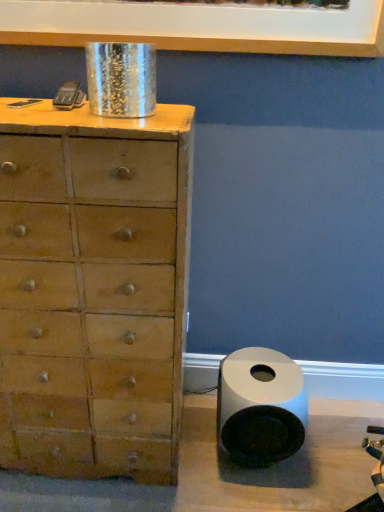
Question: Is wooden chest of drawers at left positioned with its back to white glossy speaker at lower right?

Choices:
 (A) yes
 (B) no

Answer: (B)

Question: Can you confirm if wooden chest of drawers at left is smaller than white glossy speaker at lower right?

Choices:
 (A) no
 (B) yes

Answer: (A)

Question: Is wooden chest of drawers at left outside of white glossy speaker at lower right?

Choices:
 (A) no
 (B) yes

Answer: (B)

Question: From a real-world perspective, is wooden chest of drawers at left located beneath white glossy speaker at lower right?

Choices:
 (A) no
 (B) yes

Answer: (A)

Question: From the image's perspective, is wooden chest of drawers at left under white glossy speaker at lower right?

Choices:
 (A) yes
 (B) no

Answer: (B)

Question: From the image's perspective, relative to white glossy picture frame at upper center, is wooden chest of drawers at left above or below?

Choices:
 (A) above
 (B) below

Answer: (B)

Question: From a real-world perspective, relative to white glossy picture frame at upper center, is wooden chest of drawers at left vertically above or below?

Choices:
 (A) above
 (B) below

Answer: (B)

Question: From their relative heights in the image, would you say wooden chest of drawers at left is taller or shorter than white glossy picture frame at upper center?

Choices:
 (A) tall
 (B) short

Answer: (A)

Question: Is wooden chest of drawers at left wider or thinner than white glossy picture frame at upper center?

Choices:
 (A) thin
 (B) wide

Answer: (B)

Question: Considering the positions of point (251, 454) and point (61, 130), is point (251, 454) closer or farther from the camera than point (61, 130)?

Choices:
 (A) closer
 (B) farther

Answer: (B)

Question: Considering the positions of white glossy speaker at lower right and wooden chest of drawers at left in the image, is white glossy speaker at lower right wider or thinner than wooden chest of drawers at left?

Choices:
 (A) thin
 (B) wide

Answer: (A)

Question: Is white glossy speaker at lower right bigger or smaller than wooden chest of drawers at left?

Choices:
 (A) big
 (B) small

Answer: (B)

Question: In terms of height, does white glossy speaker at lower right look taller or shorter compared to wooden chest of drawers at left?

Choices:
 (A) short
 (B) tall

Answer: (A)

Question: Considering the positions of point click(274, 354) and point click(349, 53), is point click(274, 354) closer or farther from the camera than point click(349, 53)?

Choices:
 (A) closer
 (B) farther

Answer: (B)

Question: In the image, is white glossy speaker at lower right on the left side or the right side of white glossy picture frame at upper center?

Choices:
 (A) left
 (B) right

Answer: (B)